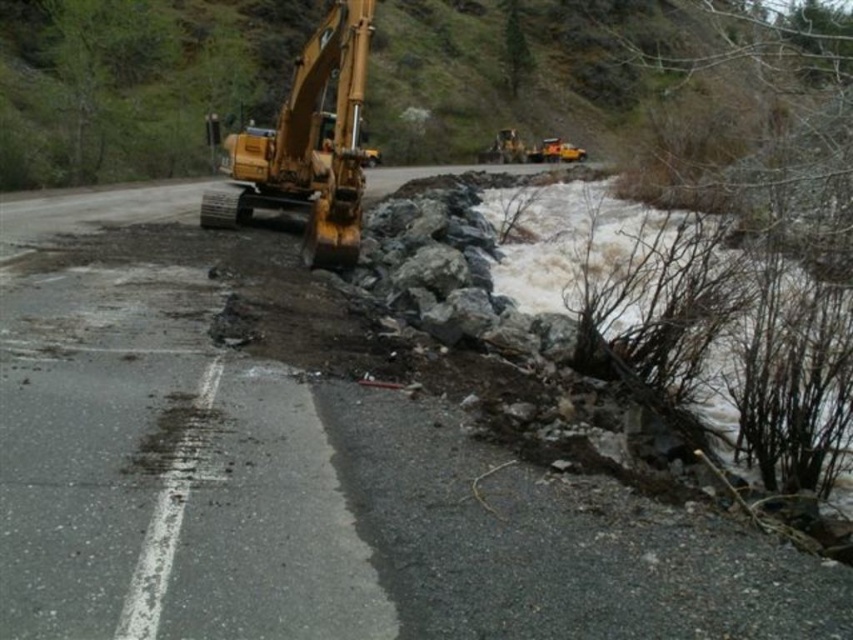
Question: Is white frothy water at lower right below yellow metallic excavator at left?

Choices:
 (A) no
 (B) yes

Answer: (B)

Question: Among these objects, which one is nearest to the camera?

Choices:
 (A) white frothy water at lower right
 (B) yellow metallic excavator at center
 (C) yellow metallic excavator at left

Answer: (A)

Question: Can you confirm if white frothy water at lower right is positioned below yellow metallic excavator at center?

Choices:
 (A) no
 (B) yes

Answer: (B)

Question: Is white frothy water at lower right to the left of yellow metallic excavator at left from the viewer's perspective?

Choices:
 (A) yes
 (B) no

Answer: (B)

Question: Which of these objects is positioned farthest from the yellow metallic excavator at center?

Choices:
 (A) white frothy water at lower right
 (B) yellow metallic excavator at left

Answer: (A)

Question: Considering the real-world distances, which object is closest to the yellow metallic excavator at center?

Choices:
 (A) white frothy water at lower right
 (B) yellow metallic excavator at left

Answer: (B)